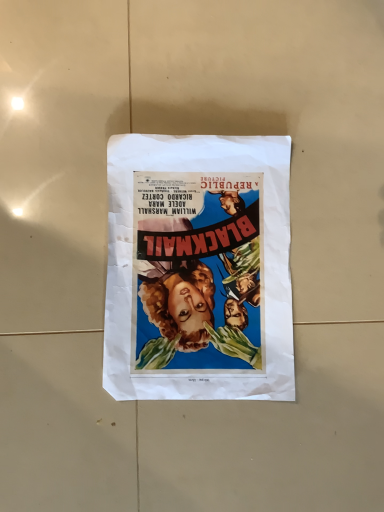
At what (x,y) coordinates should I click in order to perform the action: click on matte paper poster at center. Please return your answer as a coordinate pair (x, y). The width and height of the screenshot is (384, 512). Looking at the image, I should click on (198, 268).

Describe the element at coordinates (198, 268) in the screenshot. Image resolution: width=384 pixels, height=512 pixels. I see `matte paper poster at center` at that location.

Where is `matte paper poster at center`? Image resolution: width=384 pixels, height=512 pixels. matte paper poster at center is located at coordinates (198, 268).